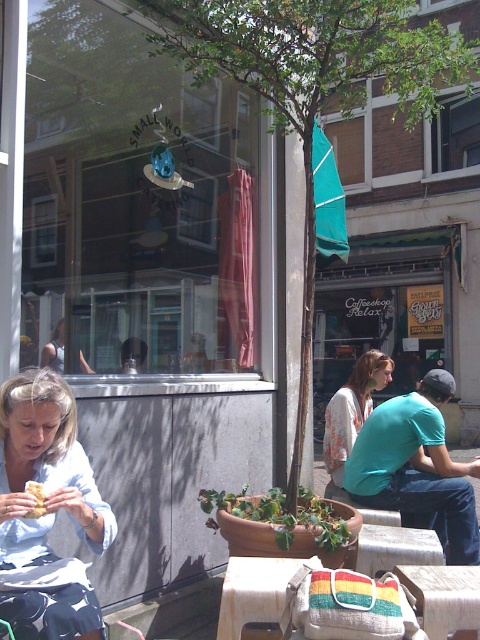
Can you confirm if light blue cotton shirt at lower left is taller than wooden table at center?

Indeed, light blue cotton shirt at lower left has a greater height compared to wooden table at center.

Who is positioned more to the right, light blue cotton shirt at lower left or wooden table at center?

wooden table at center

Which is behind, point (14, 556) or point (294, 557)?

The point (294, 557) is more distant.

Image resolution: width=480 pixels, height=640 pixels. What are the coordinates of `light blue cotton shirt at lower left` in the screenshot? It's located at (47, 513).

Identify the location of light blue cotton shirt at lower left. The width and height of the screenshot is (480, 640). (47, 513).

Can you confirm if wooden table at center is positioned to the left of wooden picnic table at center?

Incorrect, wooden table at center is not on the left side of wooden picnic table at center.

Who is shorter, wooden table at center or wooden picnic table at center?

wooden picnic table at center

Who is more distant from viewer, (223,634) or (264,588)?

Point (264,588)

Identify the location of wooden table at center. (254, 592).